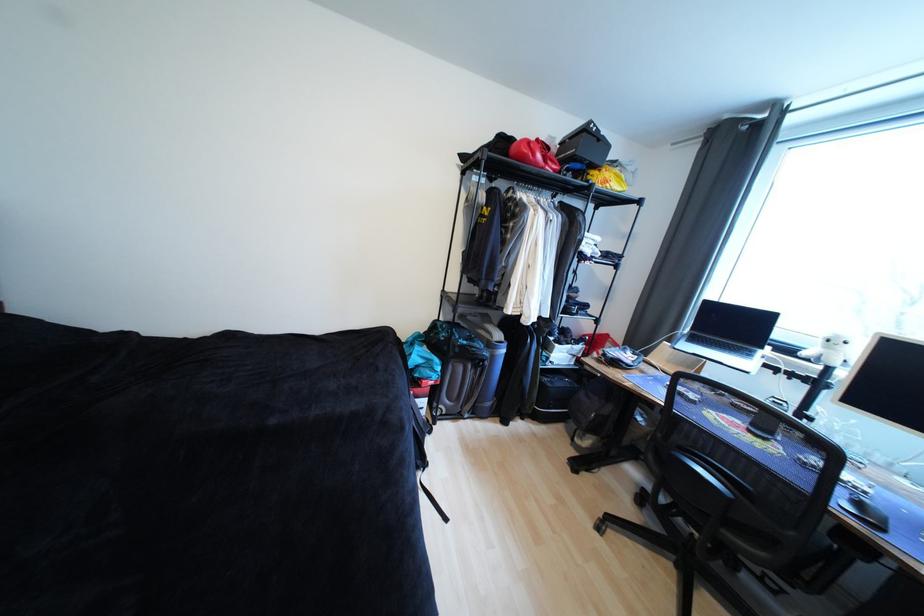
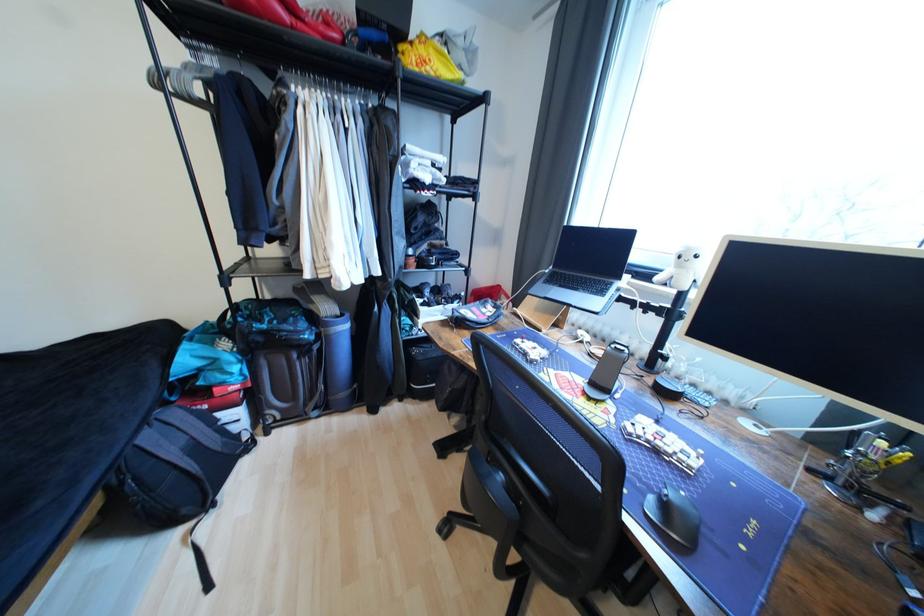
Locate, in the second image, the point that corresponds to point 809,355 in the first image.

(663, 280)